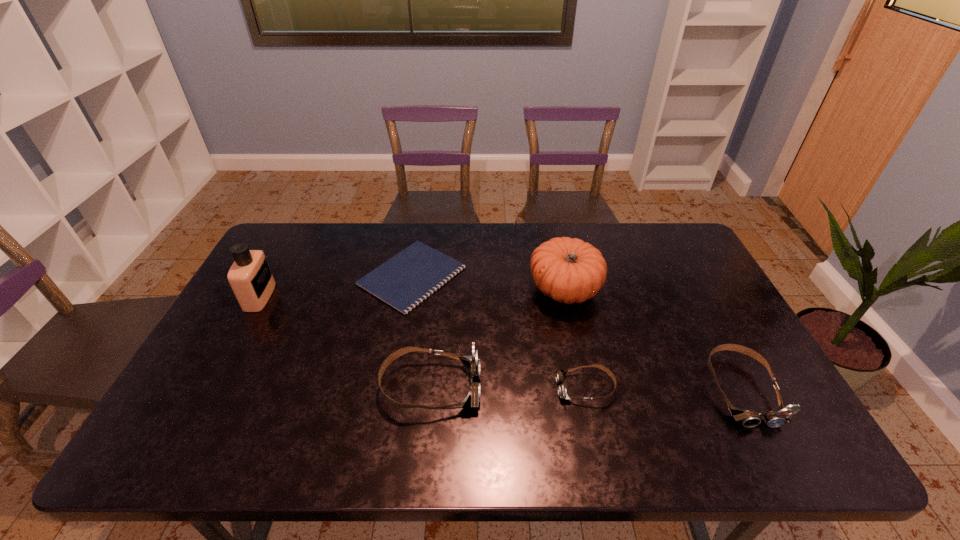
Locate an element on the screen. The image size is (960, 540). vacant space in between the shortest goggles and the leftmost goggles is located at coordinates (508, 387).

The height and width of the screenshot is (540, 960). I want to click on vacant area between the fourth tallest object and the leftmost goggles, so click(586, 388).

Locate an element on the screen. The image size is (960, 540). vacant area that lies between the leftmost goggles and the shortest goggles is located at coordinates (508, 387).

Where is `free space between the leftmost object and the second goggles from right to left`? This screenshot has width=960, height=540. free space between the leftmost object and the second goggles from right to left is located at coordinates (422, 342).

I want to click on vacant space that is in between the leftmost goggles and the pumpkin, so pyautogui.click(x=497, y=338).

At what (x,y) coordinates should I click in order to perform the action: click on object that stands as the fourth closest to the leftmost object. Please return your answer as a coordinate pair (x, y). The image size is (960, 540). Looking at the image, I should click on (560, 374).

Locate which object is the second closest to the fifth tallest object. Please provide its 2D coordinates. Your answer should be formatted as a tuple, i.e. [(x, y)], where the tuple contains the x and y coordinates of a point satisfying the conditions above.

[(569, 270)]

Identify the location of goggles that stands as the closest to the tallest object. Image resolution: width=960 pixels, height=540 pixels. (471, 363).

Identify the location of goggles identified as the second closest to the perfume. (560, 374).

Image resolution: width=960 pixels, height=540 pixels. Find the location of `free location that satisfies the following two spatial constraints: 1. on the front side of the pumpkin; 2. on the front-facing side of the second goggles from left to right`. free location that satisfies the following two spatial constraints: 1. on the front side of the pumpkin; 2. on the front-facing side of the second goggles from left to right is located at coordinates (586, 388).